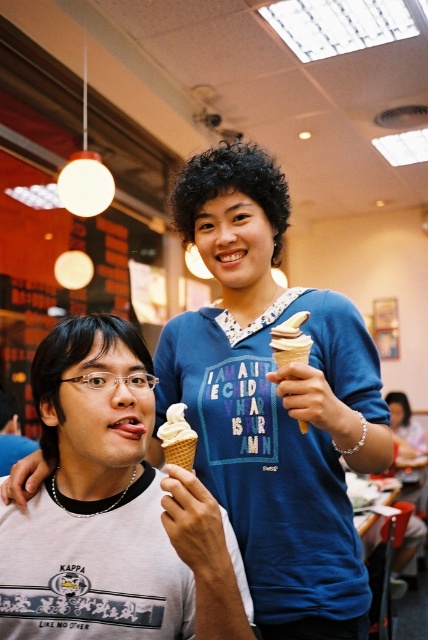
Question: Does white waffle cone at center come in front of vanilla ice cream in waffle cone at center?

Choices:
 (A) no
 (B) yes

Answer: (B)

Question: Which point is farther to the camera?

Choices:
 (A) (297, 337)
 (B) (178, 460)
 (C) (291, 506)

Answer: (C)

Question: Based on their relative distances, which object is nearer to the white matte ice cream cone at center?

Choices:
 (A) white waffle cone at center
 (B) white waffle cone ice cream at center

Answer: (A)

Question: Does white waffle cone ice cream at center appear under white waffle cone at center?

Choices:
 (A) yes
 (B) no

Answer: (B)

Question: Considering the relative positions of white waffle cone ice cream at center and white waffle cone at center in the image provided, where is white waffle cone ice cream at center located with respect to white waffle cone at center?

Choices:
 (A) below
 (B) above

Answer: (B)

Question: Which of the following is the farthest from the observer?

Choices:
 (A) white waffle cone ice cream at center
 (B) white waffle cone at center
 (C) vanilla ice cream in waffle cone at center

Answer: (A)